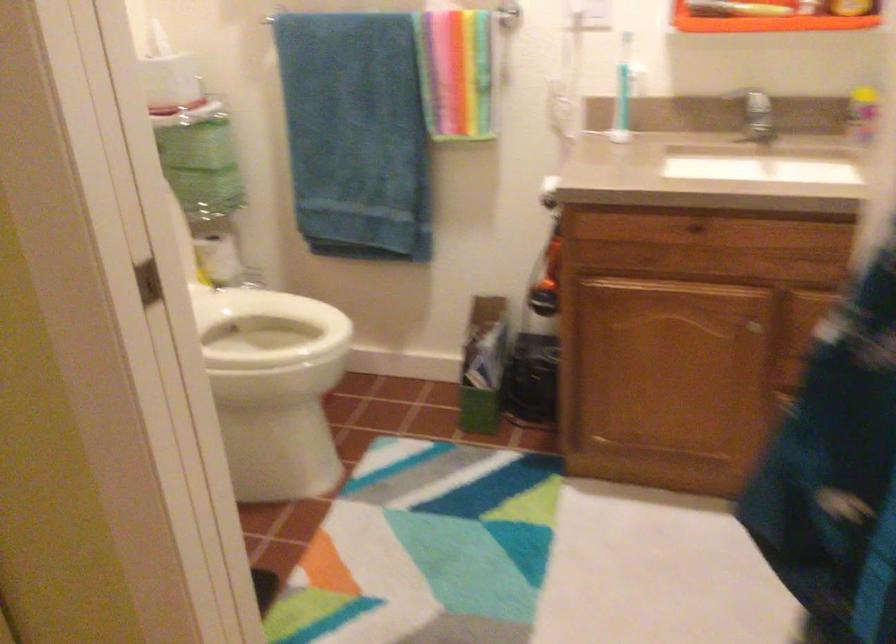
Identify the location of cabinet drawer knob. The height and width of the screenshot is (644, 896). [757, 330].